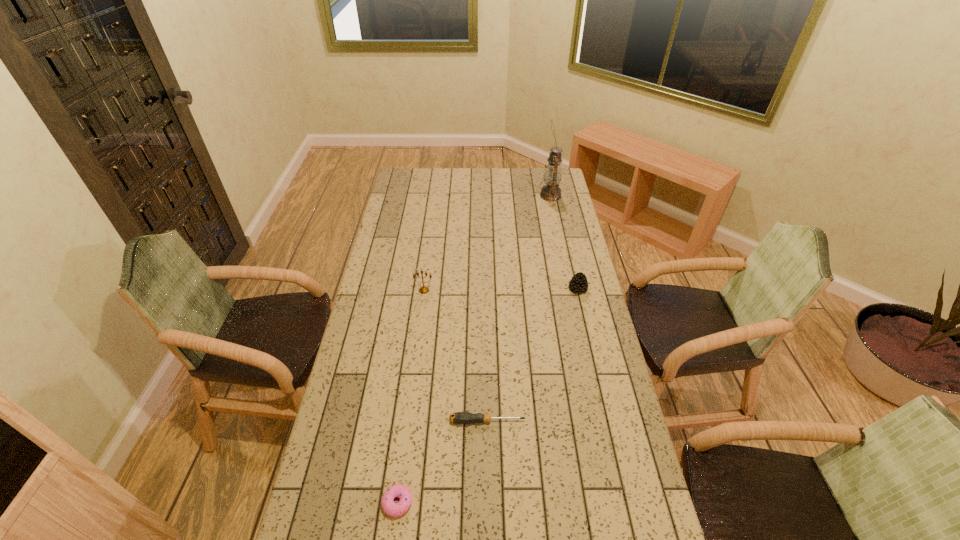
Where is `free point located 0.260m on the right of the third object from left to right`? free point located 0.260m on the right of the third object from left to right is located at coordinates [x=609, y=421].

I want to click on free spot located 0.170m on the left of the doughnut, so click(x=320, y=503).

You are a GUI agent. You are given a task and a screenshot of the screen. Output one action in this format:
    pyautogui.click(x=<x>, y=<y>)
    Task: Click on the object present at the far edge
    
    Given the screenshot: What is the action you would take?
    pyautogui.click(x=553, y=173)

You are a GUI agent. You are given a task and a screenshot of the screen. Output one action in this format:
    pyautogui.click(x=<x>, y=<y>)
    Task: Click on the oil lamp at the right edge
    The image size is (960, 540).
    Given the screenshot: What is the action you would take?
    pyautogui.click(x=553, y=173)

Where is `pinecone at the right edge`? This screenshot has width=960, height=540. pinecone at the right edge is located at coordinates (579, 284).

The image size is (960, 540). Identify the location of object positioned at the far right corner. (553, 173).

What are the coordinates of `vacant space at the far edge of the desktop` in the screenshot? It's located at (492, 179).

I want to click on vacant space at the left edge of the desktop, so (x=361, y=363).

Identify the location of vacant point at the right edge. (577, 386).

Find the location of `vacant space at the far left corner of the desktop`. vacant space at the far left corner of the desktop is located at coordinates (422, 177).